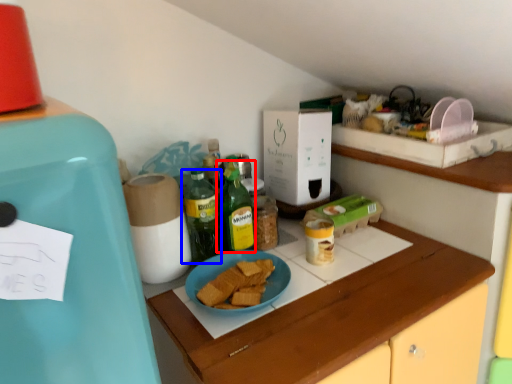
Question: Which object appears farthest to the camera in this image, bottle (highlighted by a red box) or bottle (highlighted by a blue box)?

Choices:
 (A) bottle
 (B) bottle

Answer: (A)